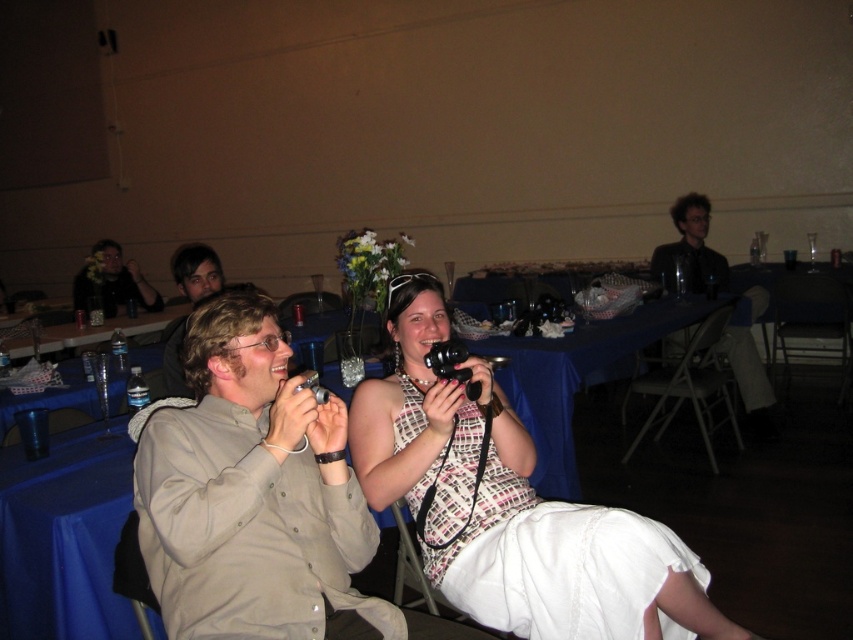
You are standing at the entrance of the hall and want to locate the blue fabric table at center. According to the coordinates provided, in which direction should you walk to reach it?

The blue fabric table at center is located at coordinates point (x=579, y=374). Since you are at the entrance, you should walk towards the center of the hall to reach it.

You are planning to take a photo of the dark gray suit at upper right and the black plastic camera at center. Which object should you focus on first if you want to capture both in a single frame without adjusting your camera angle?

You should focus on the dark gray suit at upper right first because it is taller than the black plastic camera at center, ensuring it fits within the frame properly.

You are a photographer at the wedding reception. You need to capture a photo of the white textured dress at center without including the clear plastic water bottles at left in the frame. Based on their positions, is this possible?

The white textured dress at center is located below the clear plastic water bottles at left, so if you position your camera to aim downward towards the dress while ensuring the bottles are out of the frame above, it should be possible to capture the dress without including the bottles.